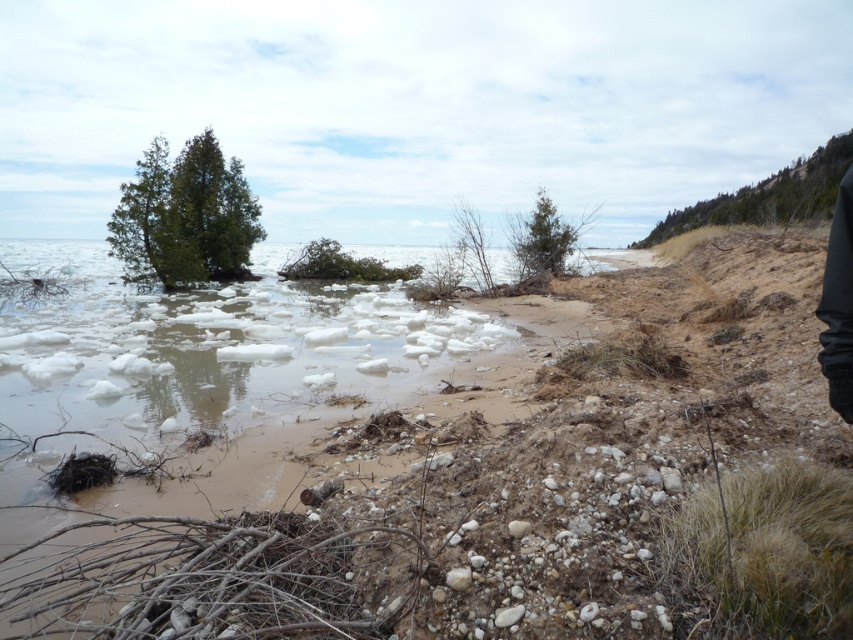
Is green matte tree at upper center closer to camera compared to green leafy bush at center?

Yes, it is.

Does green matte tree at upper center appear over green leafy bush at center?

Yes.

Between point (531, 218) and point (292, 266), which one is positioned in front?

Point (531, 218) is in front.

Identify the location of green matte tree at upper center. Image resolution: width=853 pixels, height=640 pixels. (540, 237).

Which is in front, point (132, 204) or point (347, 256)?

Point (132, 204) is in front.

Does green coniferous tree at center-left appear under green leafy bush at center?

Incorrect, green coniferous tree at center-left is not positioned below green leafy bush at center.

Between point (206, 269) and point (323, 257), which one is positioned behind?

The point (323, 257) is more distant.

Locate an element on the screen. green coniferous tree at center-left is located at coordinates (184, 216).

Can you confirm if green textured tree at upper right is positioned to the left of green leafy bush at center?

In fact, green textured tree at upper right is to the right of green leafy bush at center.

Who is positioned more to the left, green textured tree at upper right or green leafy bush at center?

Positioned to the left is green leafy bush at center.

Between point (848, 148) and point (311, 268), which one is positioned behind?

Point (848, 148)

The image size is (853, 640). I want to click on green textured tree at upper right, so click(769, 195).